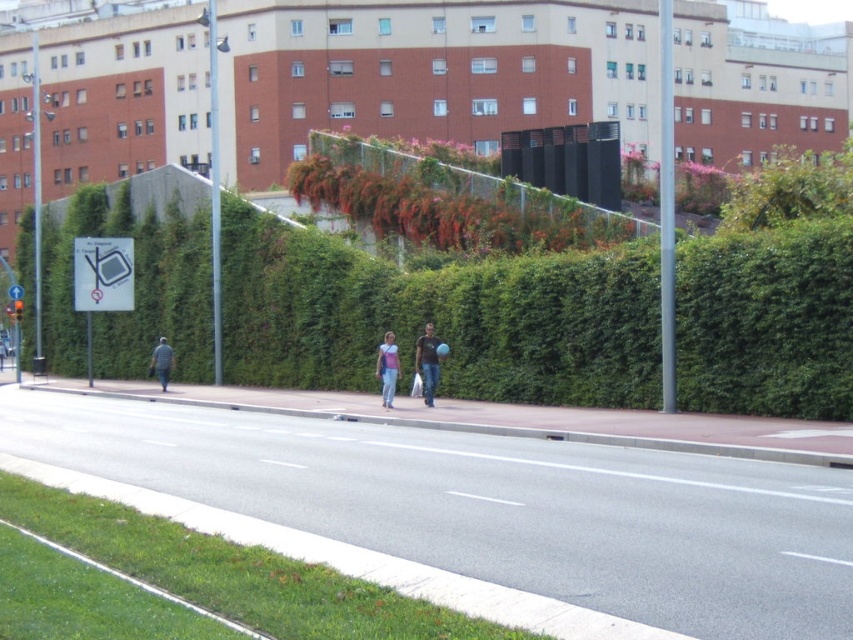
From the picture: Who is more distant from viewer, (x=386, y=225) or (x=428, y=332)?

The point (x=386, y=225) is more distant.

Which is more to the left, green leafy bush at upper center or dark brown leather jacket at center?

From the viewer's perspective, dark brown leather jacket at center appears more on the left side.

Locate an element on the screen. green leafy bush at upper center is located at coordinates (445, 200).

The height and width of the screenshot is (640, 853). In order to click on green leafy bush at upper center in this screenshot , I will do `click(445, 200)`.

This screenshot has width=853, height=640. What are the coordinates of `matte plastic sign at left` in the screenshot? It's located at click(102, 273).

Is matte plastic sign at left closer to camera compared to denim jeans at center?

Yes, it is.

Who is more distant from viewer, (78, 243) or (3, 342)?

The point (3, 342) is more distant.

Identify the location of matte plastic sign at left. The width and height of the screenshot is (853, 640). (102, 273).

Is point (165, 346) positioned before point (18, 288)?

Yes, it is.

Which of these two, blue denim jacket at left or white plastic sign at left, stands shorter?

With less height is blue denim jacket at left.

Does point (161, 376) come behind point (13, 291)?

No, it is in front of (13, 291).

Find the location of `blue denim jacket at left`. blue denim jacket at left is located at coordinates (161, 362).